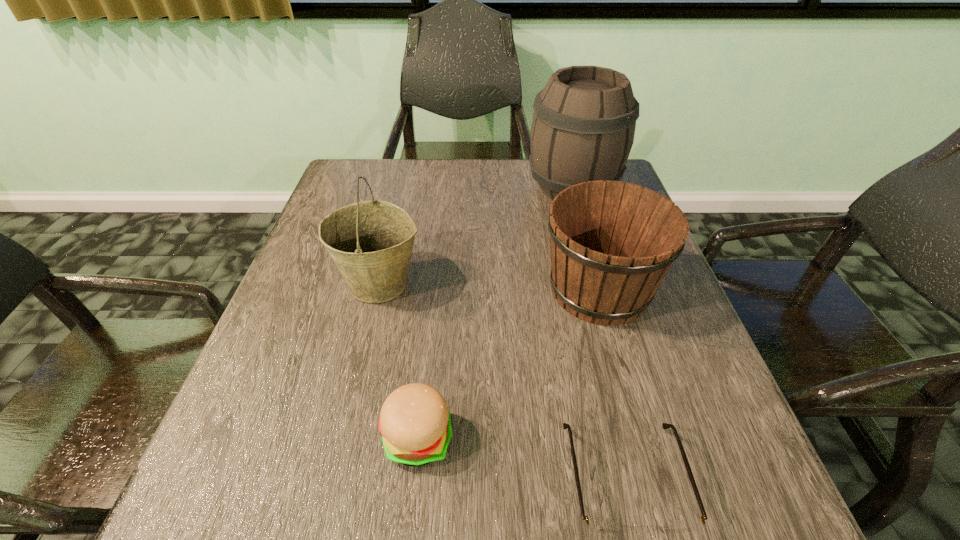
The width and height of the screenshot is (960, 540). I want to click on vacant region that satisfies the following two spatial constraints: 1. on the back side of the farthest object; 2. on the right side of the third tallest object, so click(570, 188).